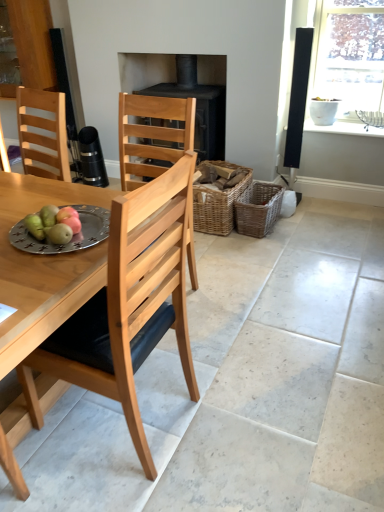
At what (x,y) coordinates should I click in order to perform the action: click on vacant space behind green matte pears at table left. Please return your answer as a coordinate pair (x, y). The width and height of the screenshot is (384, 512). Looking at the image, I should click on (39, 208).